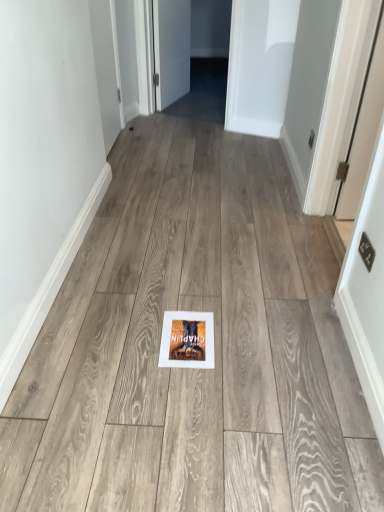
The image size is (384, 512). Find the location of `free point below matte gold postcard at center (from a real-world perspective)`. free point below matte gold postcard at center (from a real-world perspective) is located at coordinates (186, 333).